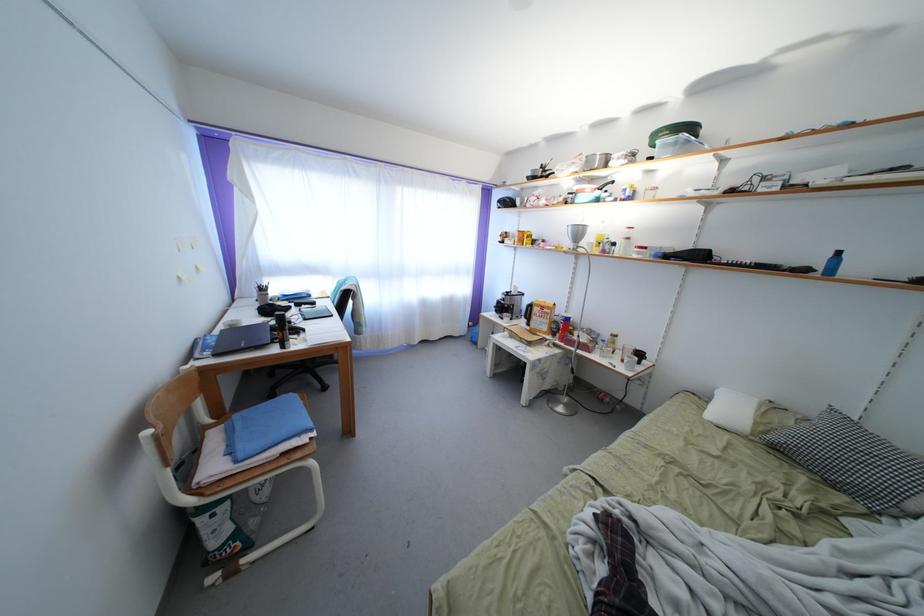
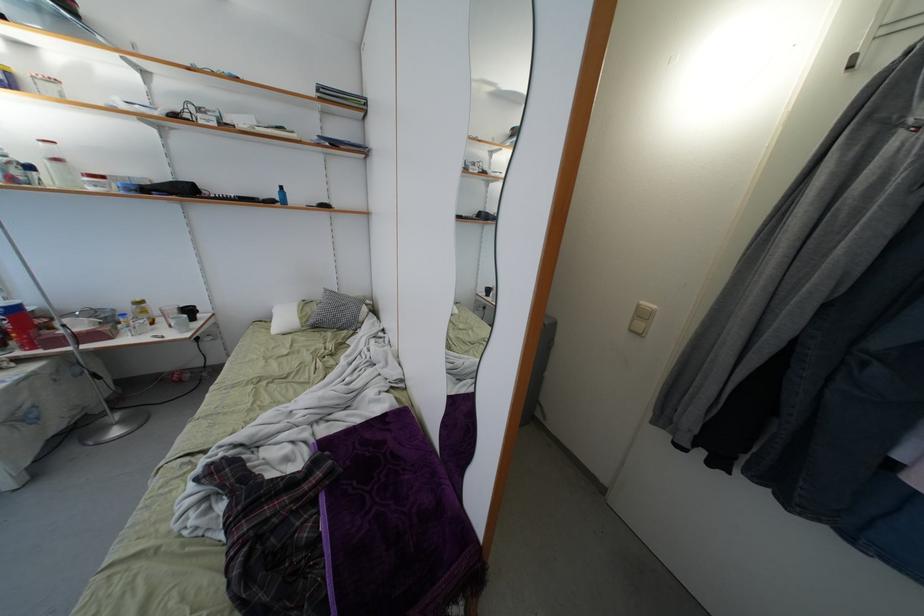
Find the pixel in the second image that matches (619,349) in the first image.

(149, 317)